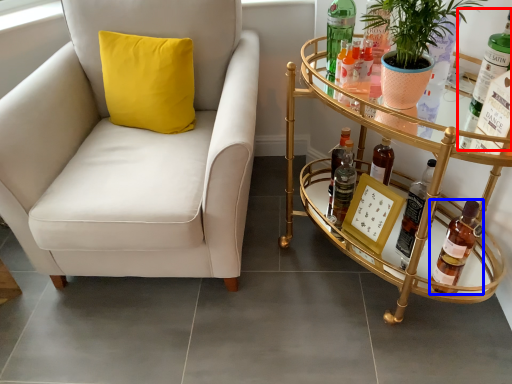
Question: Which of the following is the closest to the observer, bottle (highlighted by a red box) or bottle (highlighted by a blue box)?

Choices:
 (A) bottle
 (B) bottle

Answer: (A)